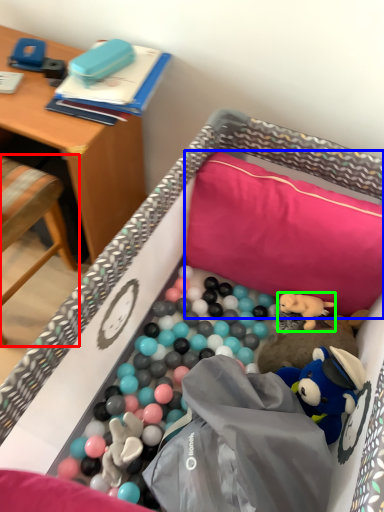
Question: Which is farther away from chair (highlighted by a red box)? pillow (highlighted by a blue box) or toy (highlighted by a green box)?

Choices:
 (A) pillow
 (B) toy

Answer: (B)